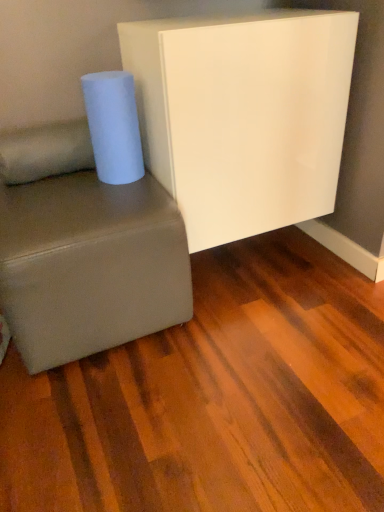
Identify the location of free space in front of white matte paper towel at left. (111, 195).